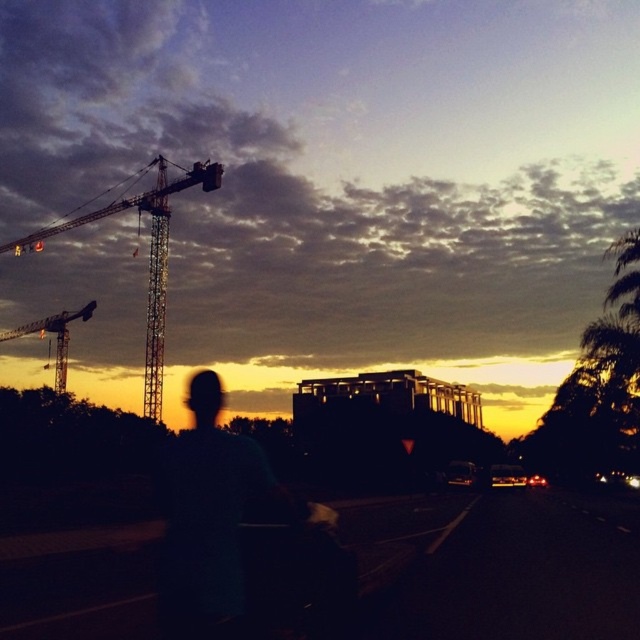
You are a city planner analyzing this image. The metallic silver crane at left is part of a construction project. Based on its position in the image, can you determine its approximate location relative to the camera? Please provide coordinates in the format of a 2D point between 0 and 1, where the bottom left corner is the origin.

The metallic silver crane at left is located at the 2D coordinates of point (148, 257) relative to the camera.

You are a city planner assessing the safety of the construction site. The two cranes are both operating simultaneously. Given that the minimum safe distance between two cranes to avoid collision is 70 meters, is the current distance between the matte black construction crane at upper left and the metallic silver crane at left sufficient?

The distance between the matte black construction crane at upper left and the metallic silver crane at left is 69.64 meters, which is less than the required 70 meters. Therefore, the current distance is insufficient to meet the safety standards for collision prevention.